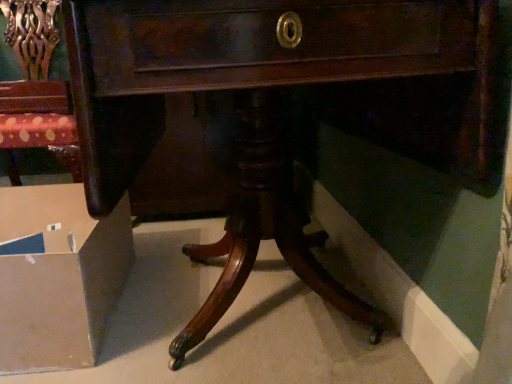
Question: From a real-world perspective, is polished wood chair at upper left physically located above or below cardboard box at lower left?

Choices:
 (A) above
 (B) below

Answer: (A)

Question: Does point (7, 153) appear closer or farther from the camera than point (15, 276)?

Choices:
 (A) farther
 (B) closer

Answer: (A)

Question: Considering their positions, is polished wood chair at upper left located in front of or behind cardboard box at lower left?

Choices:
 (A) front
 (B) behind

Answer: (B)

Question: Looking at the image, does cardboard box at lower left seem bigger or smaller compared to polished wood chair at upper left?

Choices:
 (A) small
 (B) big

Answer: (A)

Question: Is cardboard box at lower left inside or outside of polished wood chair at upper left?

Choices:
 (A) inside
 (B) outside

Answer: (B)

Question: Is point (51, 271) positioned closer to the camera than point (10, 0)?

Choices:
 (A) farther
 (B) closer

Answer: (B)

Question: Visually, is cardboard box at lower left positioned to the left or to the right of polished wood chair at upper left?

Choices:
 (A) right
 (B) left

Answer: (A)